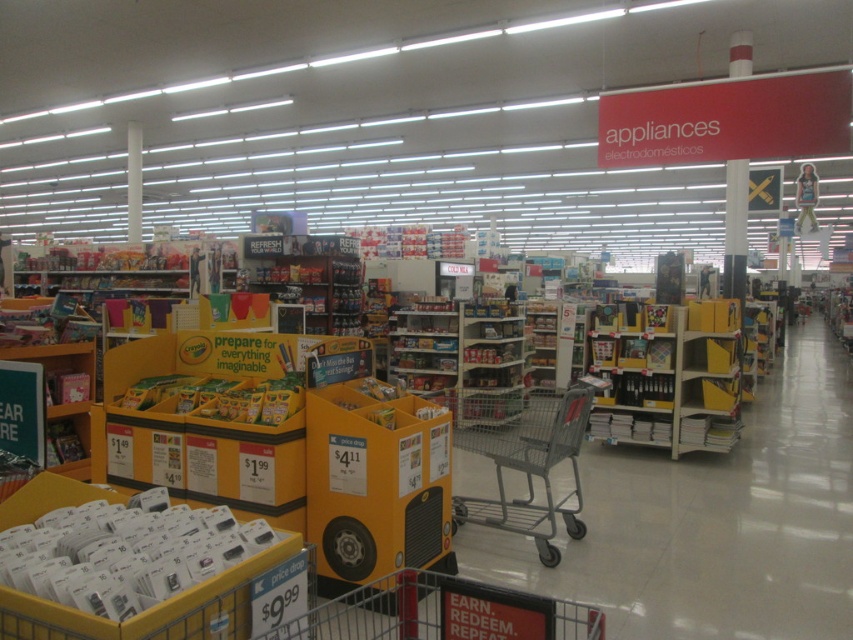
Question: Is the position of gray metal shopping cart at center more distant than that of yellow plastic shelves at center?

Choices:
 (A) no
 (B) yes

Answer: (A)

Question: Can you confirm if gray metal shopping cart at center is wider than yellow plastic shelves at center?

Choices:
 (A) no
 (B) yes

Answer: (B)

Question: Can you confirm if gray metal shopping cart at center is bigger than yellow plastic shelves at center?

Choices:
 (A) yes
 (B) no

Answer: (B)

Question: Which point is farther to the camera?

Choices:
 (A) gray metal shopping cart at center
 (B) yellow plastic shelves at center

Answer: (B)

Question: Which object is closer to the camera taking this photo?

Choices:
 (A) gray metal shopping cart at center
 (B) yellow plastic shelves at center

Answer: (A)